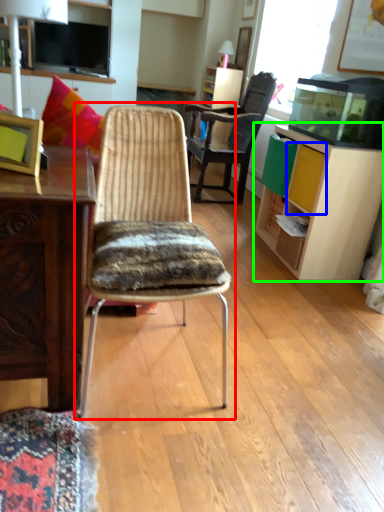
Question: Considering the real-world distances, which object is farthest from chair (highlighted by a red box)? drawer (highlighted by a blue box) or cabinetry (highlighted by a green box)?

Choices:
 (A) drawer
 (B) cabinetry

Answer: (B)